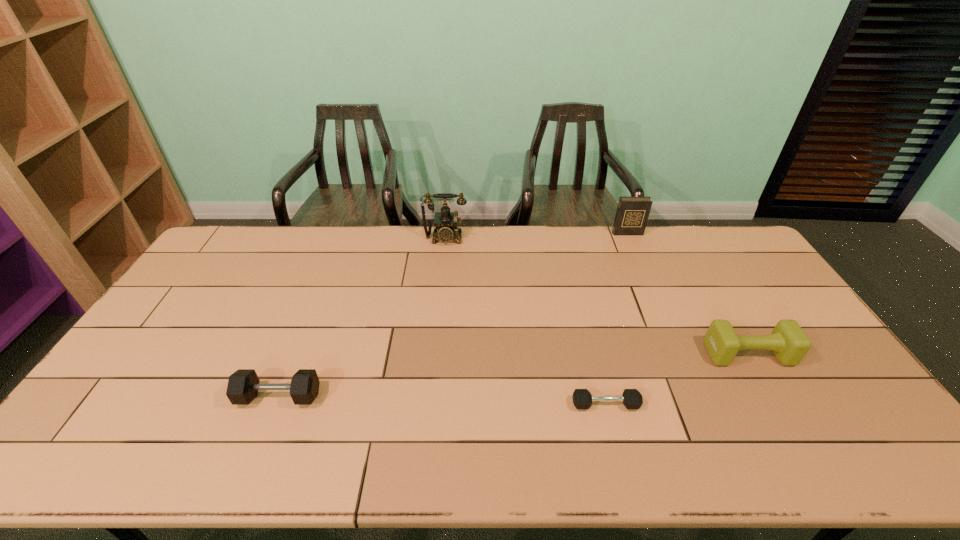
At what (x,y) coordinates should I click in order to perform the action: click on vacant area situated on the front cover of the second object from right to left. Please return your answer as a coordinate pair (x, y). The width and height of the screenshot is (960, 540). Looking at the image, I should click on [656, 299].

Find the location of `free region located 0.130m on the left of the rightmost dumbbell`. free region located 0.130m on the left of the rightmost dumbbell is located at coordinates (661, 354).

At what (x,y) coordinates should I click in order to perform the action: click on vacant space located 0.300m on the right of the leftmost object. Please return your answer as a coordinate pair (x, y). This screenshot has height=540, width=960. Looking at the image, I should click on (436, 397).

Where is `vacant space located 0.310m on the back of the shortest object`? The image size is (960, 540). vacant space located 0.310m on the back of the shortest object is located at coordinates (583, 312).

The image size is (960, 540). I want to click on telephone that is at the far edge, so click(x=445, y=221).

This screenshot has width=960, height=540. I want to click on diary that is at the far edge, so click(x=632, y=213).

Locate an element on the screen. object present at the right edge is located at coordinates (789, 343).

Image resolution: width=960 pixels, height=540 pixels. Identify the location of vacant region at the far edge of the desktop. (441, 258).

Image resolution: width=960 pixels, height=540 pixels. In the image, there is a desktop. In order to click on vacant space at the near edge in this screenshot , I will do `click(263, 453)`.

In the image, there is a desktop. Where is `blank space at the right edge`? The height and width of the screenshot is (540, 960). blank space at the right edge is located at coordinates (836, 369).